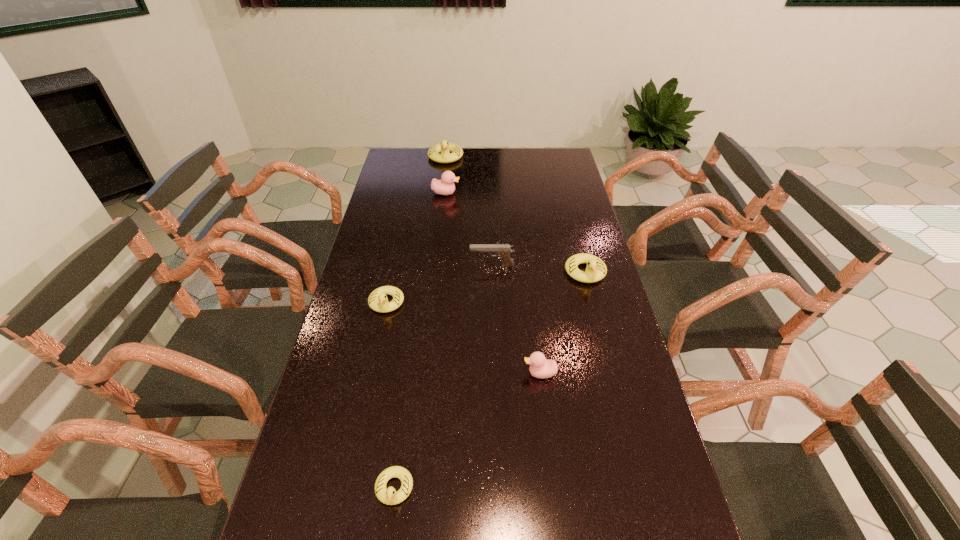
You are a GUI agent. You are given a task and a screenshot of the screen. Output one action in this format:
    pyautogui.click(x=<x>, y=<y>)
    Task: Click on the free spot located on the front-facing side of the second object from right to left
    Image resolution: width=960 pixels, height=540 pixels.
    Given the screenshot: What is the action you would take?
    pyautogui.click(x=385, y=373)

Identify the location of blank area located on the front-facing side of the second object from right to left. (482, 373).

Identify the location of vacant point located 0.210m on the face of the second smallest yellow duckling. (371, 376).

The height and width of the screenshot is (540, 960). I want to click on vacant area situated 0.050m on the face of the shortest duckling, so click(388, 537).

Find the location of `object at the far edge`. object at the far edge is located at coordinates (444, 147).

You are a GUI agent. You are given a task and a screenshot of the screen. Output one action in this format:
    pyautogui.click(x=<x>, y=<y>)
    Task: Click on the object that is at the left edge
    Image resolution: width=960 pixels, height=540 pixels.
    Given the screenshot: What is the action you would take?
    pyautogui.click(x=378, y=301)

This screenshot has width=960, height=540. I want to click on object present at the right edge, so click(596, 269).

You are a GUI agent. You are given a task and a screenshot of the screen. Output one action in this format:
    pyautogui.click(x=<x>, y=<y>)
    Task: Click on the free space at the far edge
    
    Given the screenshot: What is the action you would take?
    pyautogui.click(x=463, y=170)

The width and height of the screenshot is (960, 540). I want to click on free space at the left edge, so click(370, 433).

This screenshot has width=960, height=540. In order to click on blank space at the right edge of the desktop in this screenshot , I will do `click(661, 531)`.